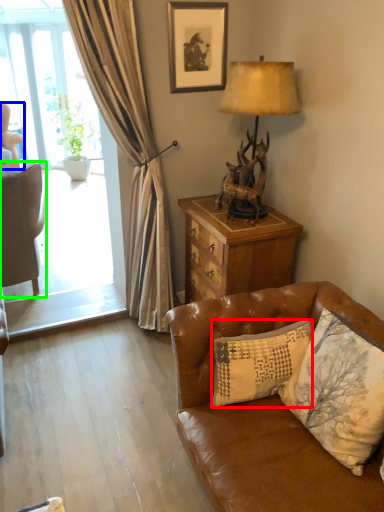
Question: Which object is the farthest from pillow (highlighted by a red box)? Choose among these: chair (highlighted by a blue box) or chair (highlighted by a green box).

Choices:
 (A) chair
 (B) chair

Answer: (A)